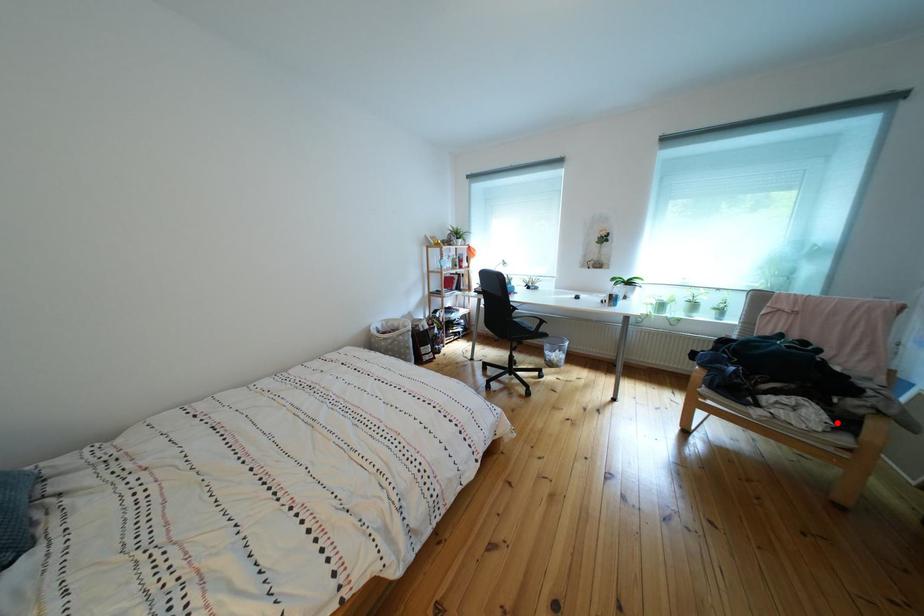
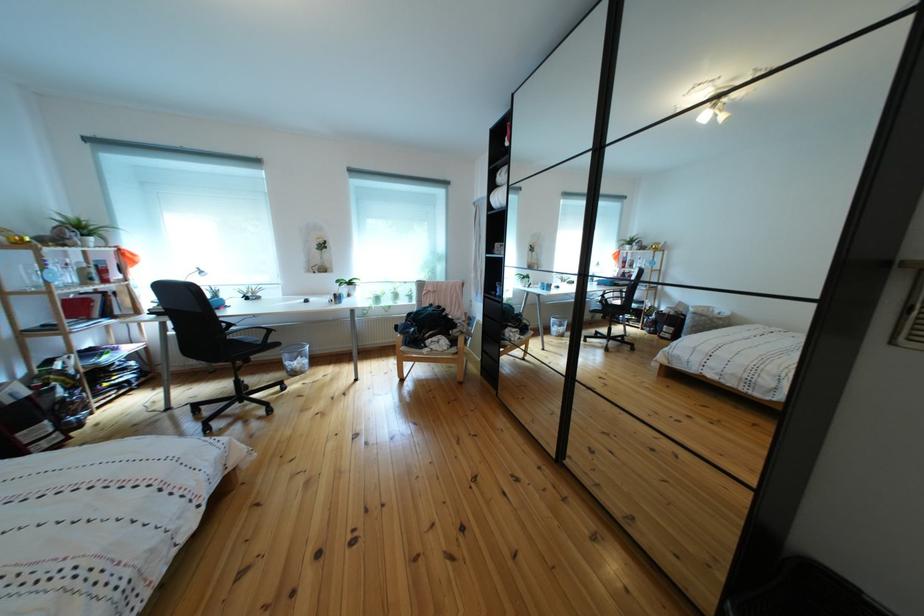
Question: I am providing you with two images of the same scene from different viewpoints. In image1, a red point is highlighted. Considering the same 3D point in image2, which of the following is correct?

Choices:
 (A) It is closer
 (B) It is farther

Answer: (B)